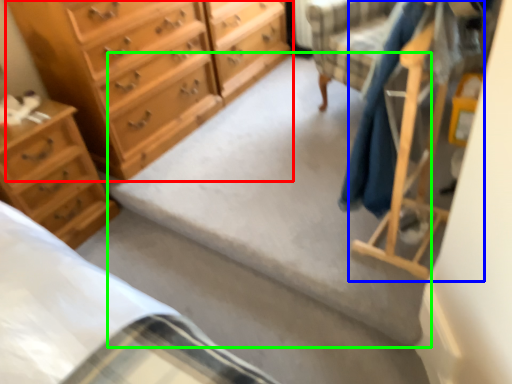
Question: Considering the real-world distances, which object is farthest from chest of drawers (highlighted by a red box)? furniture (highlighted by a blue box) or concrete (highlighted by a green box)?

Choices:
 (A) furniture
 (B) concrete

Answer: (A)